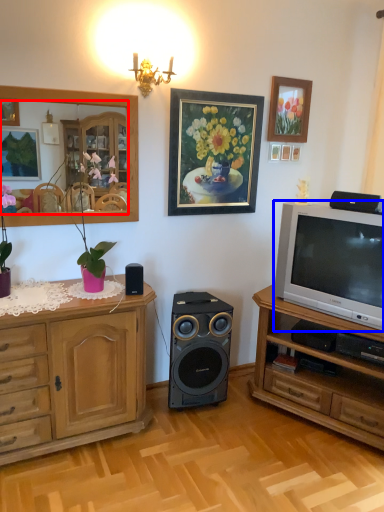
Question: Which object appears closest to the camera in this image, mirror (highlighted by a red box) or television (highlighted by a blue box)?

Choices:
 (A) mirror
 (B) television

Answer: (A)